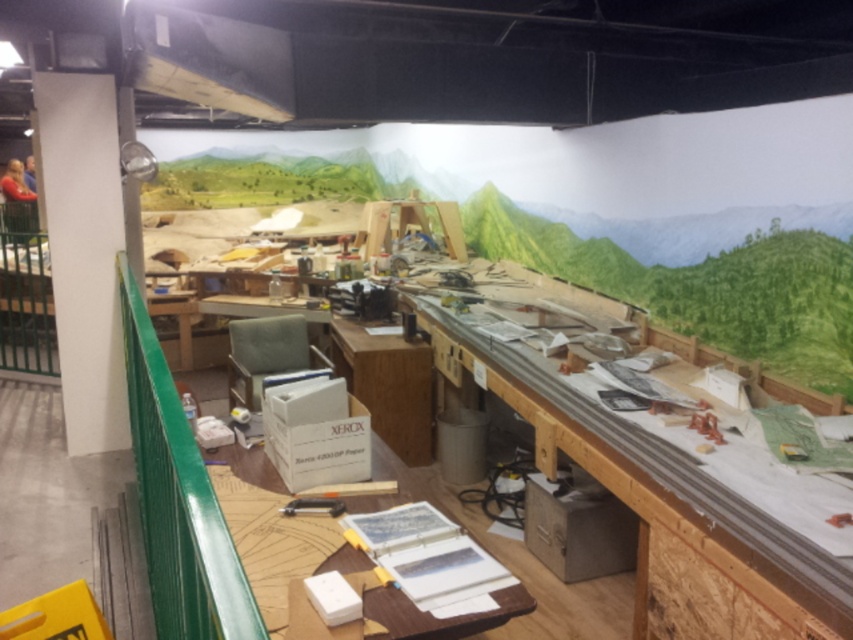
Question: Is white smooth pillar at left above wooden at center?

Choices:
 (A) yes
 (B) no

Answer: (A)

Question: Where is wooden table at center located in relation to white smooth pillar at left in the image?

Choices:
 (A) right
 (B) left

Answer: (A)

Question: Which of the following is the farthest from the observer?

Choices:
 (A) (271, 596)
 (B) (805, 595)

Answer: (A)

Question: Can you confirm if white smooth pillar at left is smaller than wooden at center?

Choices:
 (A) no
 (B) yes

Answer: (A)

Question: Which of these objects is positioned closest to the white smooth pillar at left?

Choices:
 (A) wooden table at center
 (B) wooden at center

Answer: (B)

Question: Which point is farther to the camera?

Choices:
 (A) white smooth pillar at left
 (B) wooden at center

Answer: (A)